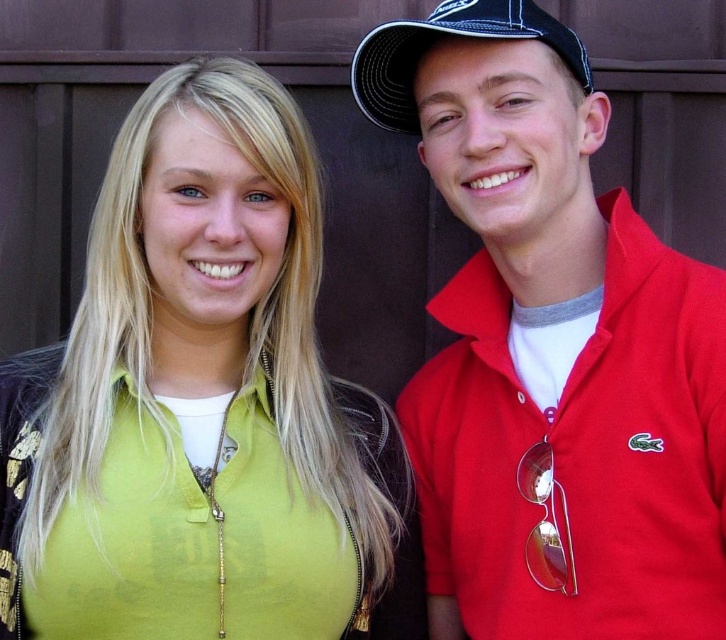
In the scene shown: You are trying to determine the relative heights of the two items in the image. Which object is taller between the matte red polo shirt at right and the black mesh baseball cap at upper right?

The matte red polo shirt at right is taller than the black mesh baseball cap at upper right according to the description.

You are a fashion designer observing two shirts in an image. You need to decide which one to feature in your upcoming collection. The shirts are the green matte shirt at center and the matte red polo shirt at right. Based on their positions in the image, which shirt is placed lower?

The green matte shirt at center is positioned under the matte red polo shirt at right, so it is placed lower in the image.

You are trying to decide which shirt to wear for a casual day out. Both the green matte shirt at center and the matte red polo shirt at right are options. Based on their sizes in the image, which one could potentially cover your arms better if you choose the wider one?

The green matte shirt at center might be wider than the matte red polo shirt at right, so it could potentially cover your arms better if you choose the wider one.